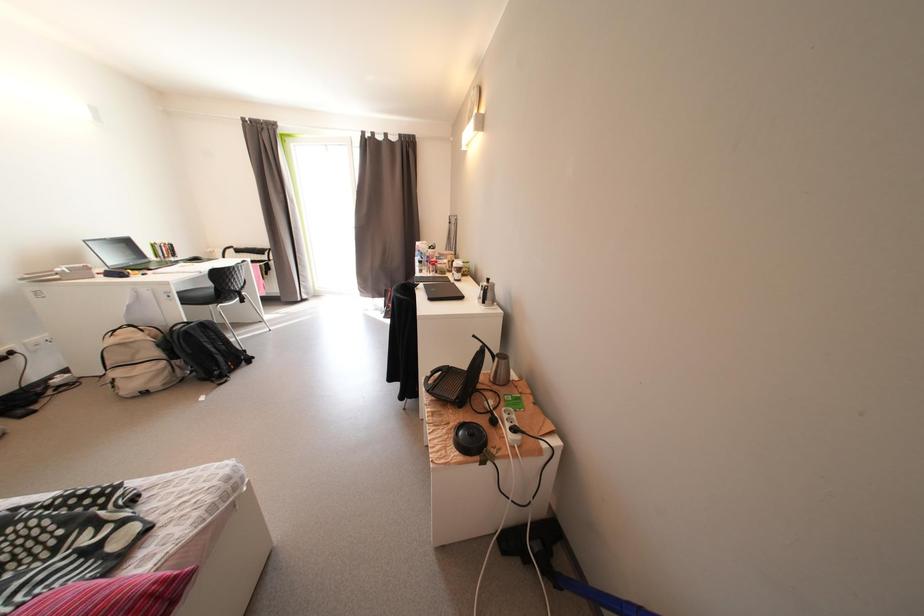
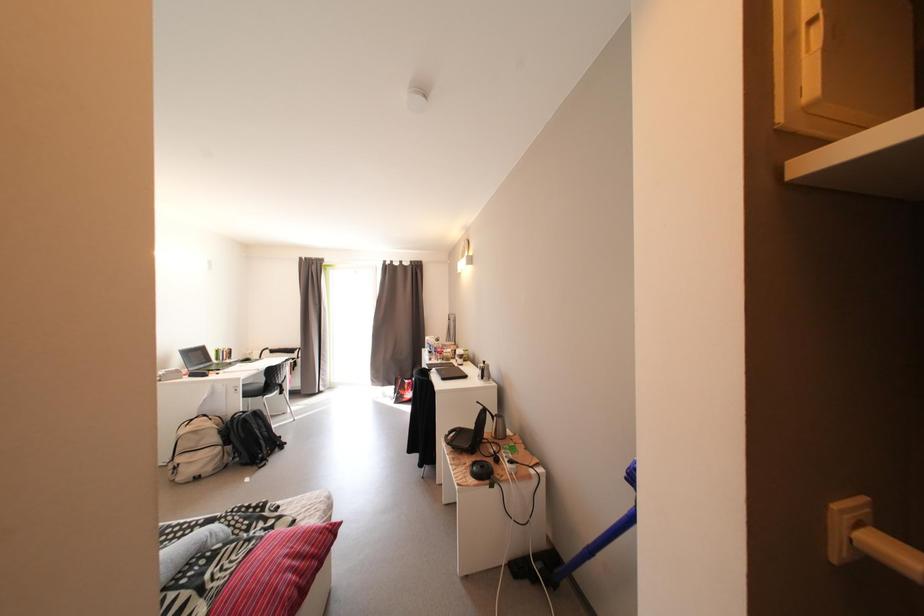
Question: In a continuous first-person perspective shot, in which direction is the camera moving?

Choices:
 (A) Left
 (B) Right
 (C) Forward
 (D) Backward

Answer: (D)